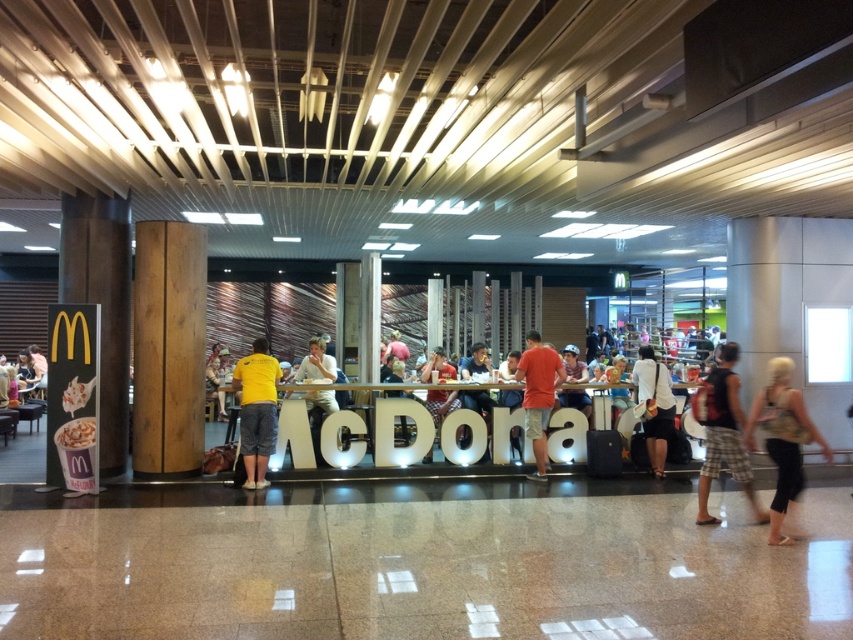
You are a customer standing at the entrance of the McDonalds and want to find the black leather pants at lower right and camouflage shorts at right. Which one is closer to you?

The black leather pants at lower right is in front of camouflage shorts at right, so it is closer to you.

You are standing at the entrance of the McDonalds and want to take a photo of the point at coordinates (x=715, y=520). The camera you are using has a maximum focus range of 6 meters. Will the camera be able to focus on the point?

The distance of point (x=715, y=520) from camera is 6.24 meters, which is beyond the camera maximum focus range of 6 meters. The camera will not be able to focus on the point.